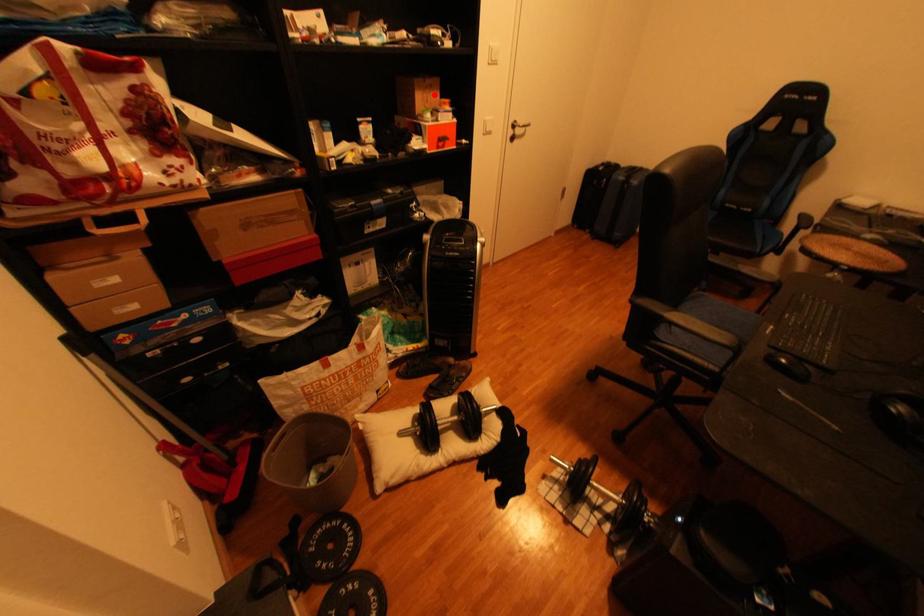
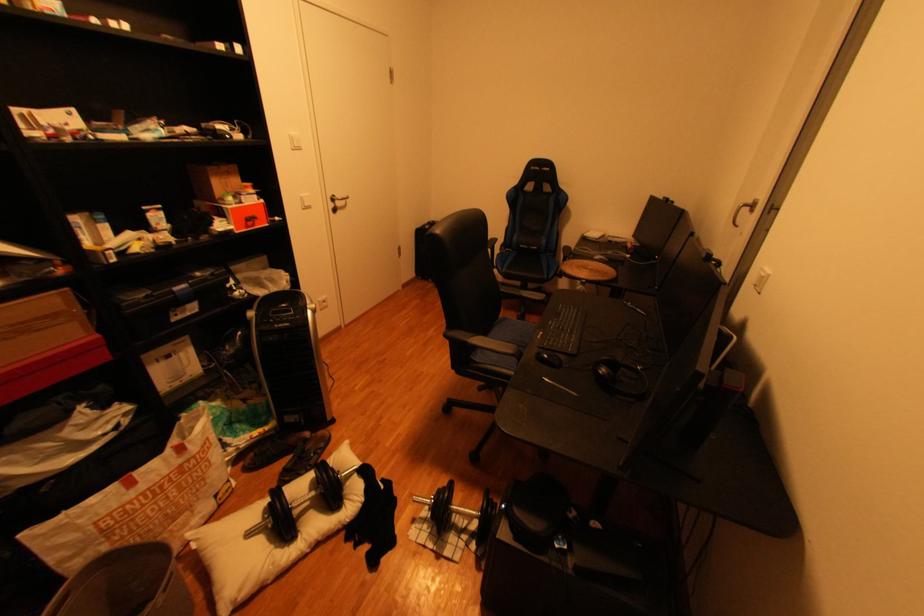
Find the pixel in the second image that matches the highlighted location in the first image.

(235, 182)